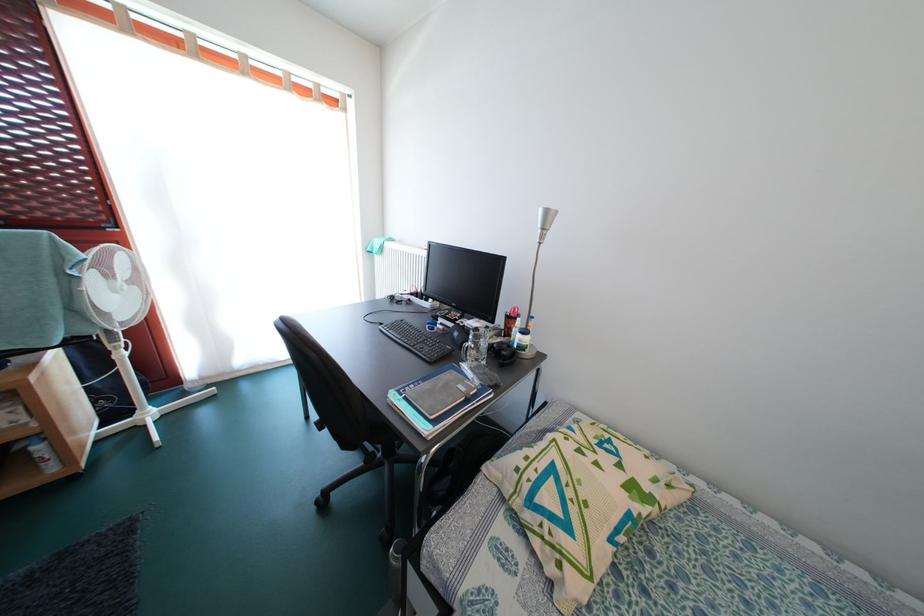
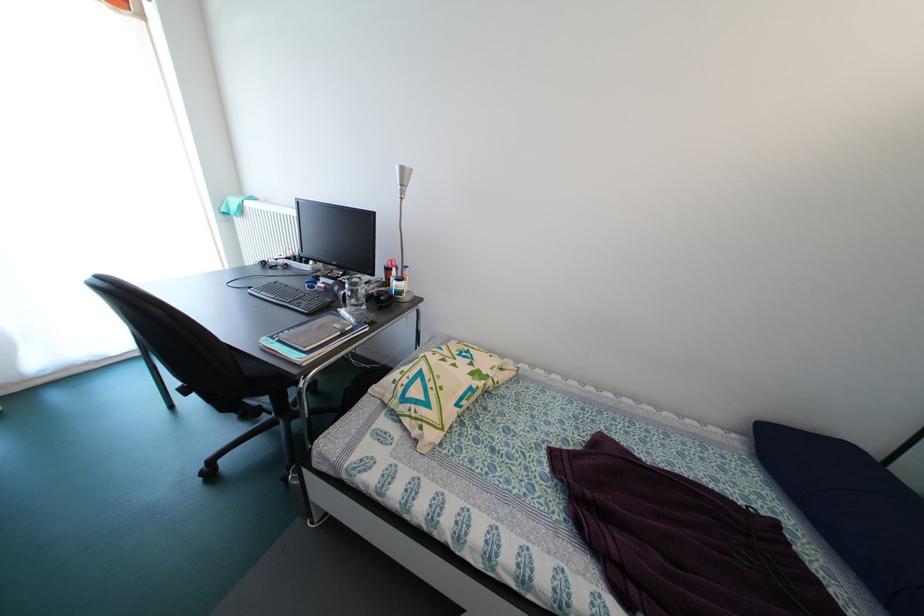
Where in the second image is the point corresponding to point (553, 217) from the first image?

(409, 175)